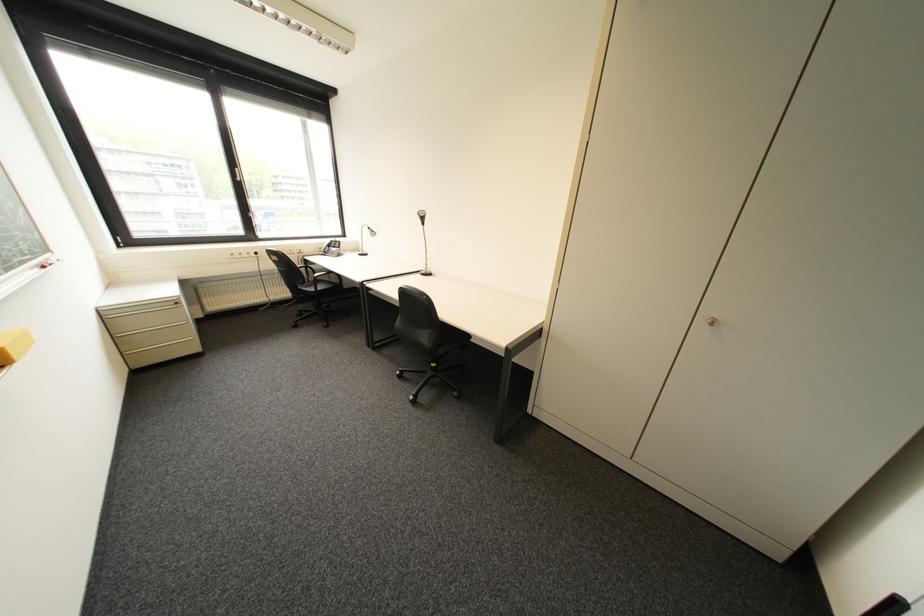
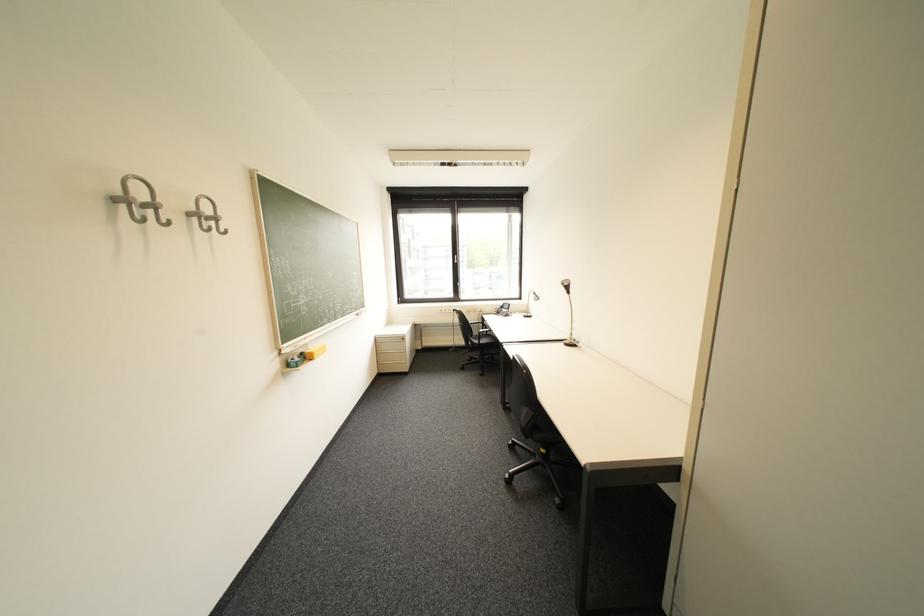
In the second image, find the point that corresponds to the point at 429,276 in the first image.

(572, 345)